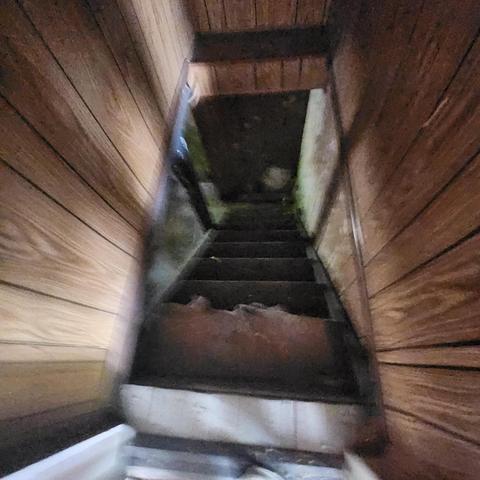
Identify the location of stairscase. The image size is (480, 480). (212, 287).